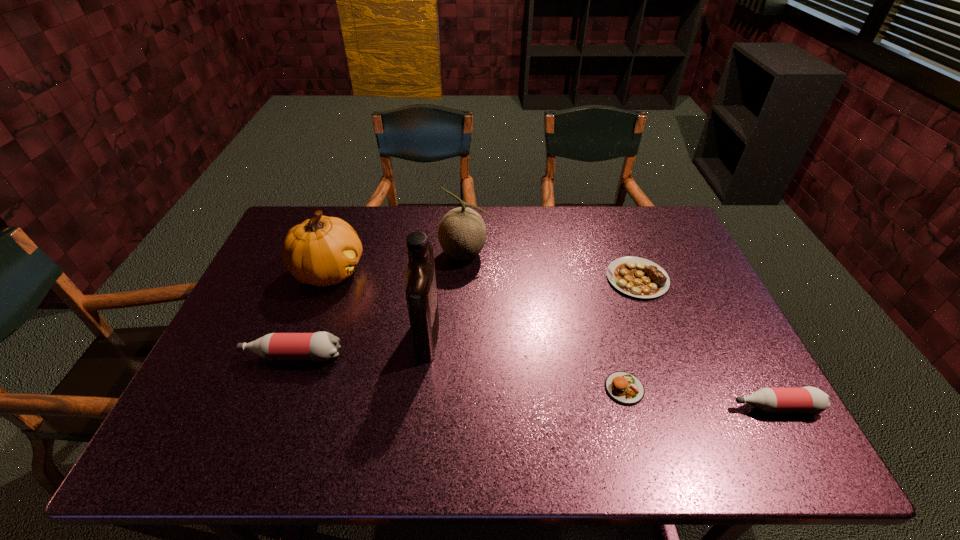
If the aim is uniform spacing by inserting an additional bottle among them, please point to a vacant space for this new bottle. Please provide its 2D coordinates. Your answer should be formatted as a tuple, i.e. [(x, y)], where the tuple contains the x and y coordinates of a point satisfying the conditions above.

[(521, 380)]